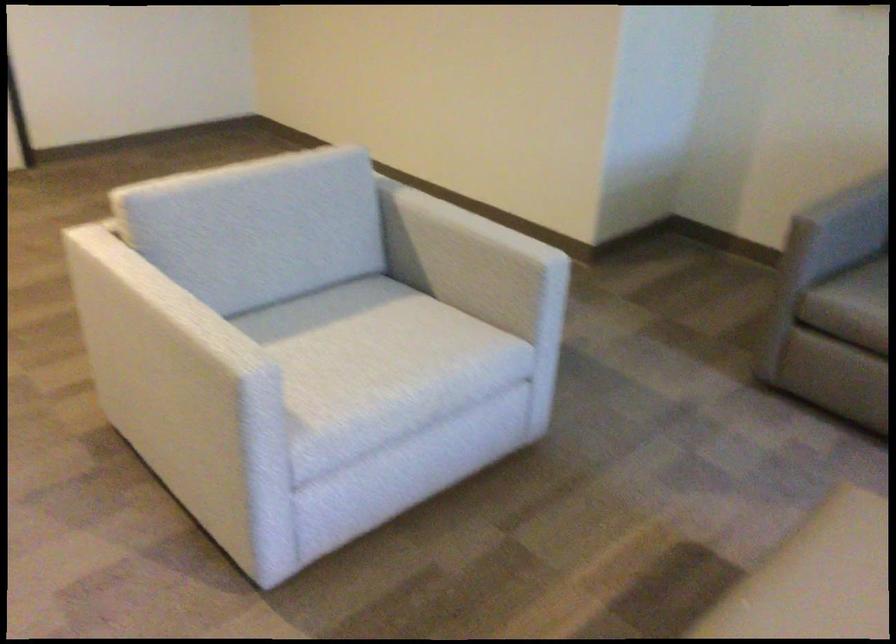
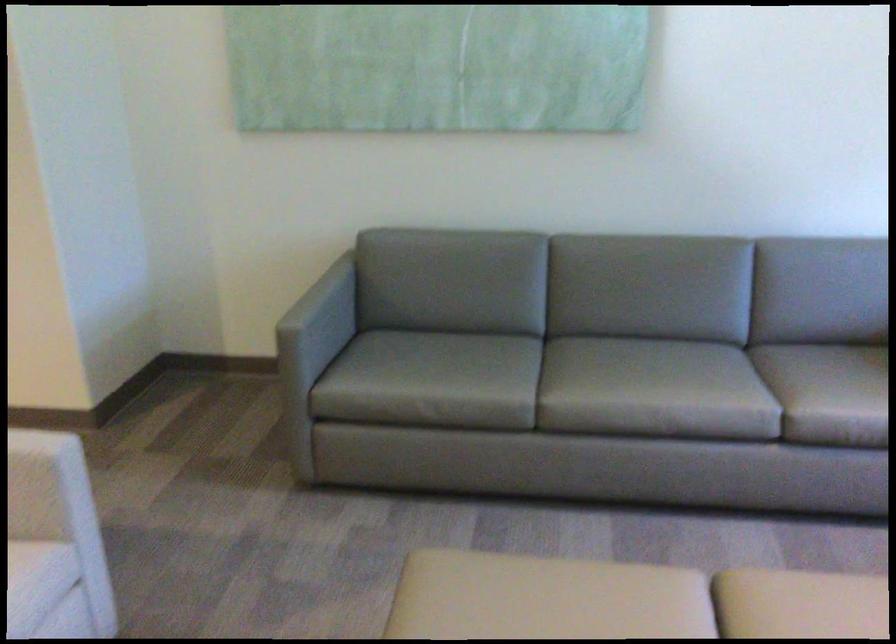
The point at (533, 333) is marked in the first image. Where is the corresponding point in the second image?

(55, 542)